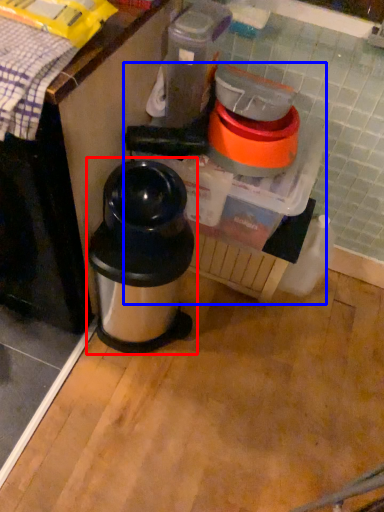
Question: Which point is further to the camera, waste container (highlighted by a red box) or blender (highlighted by a blue box)?

Choices:
 (A) waste container
 (B) blender

Answer: (B)